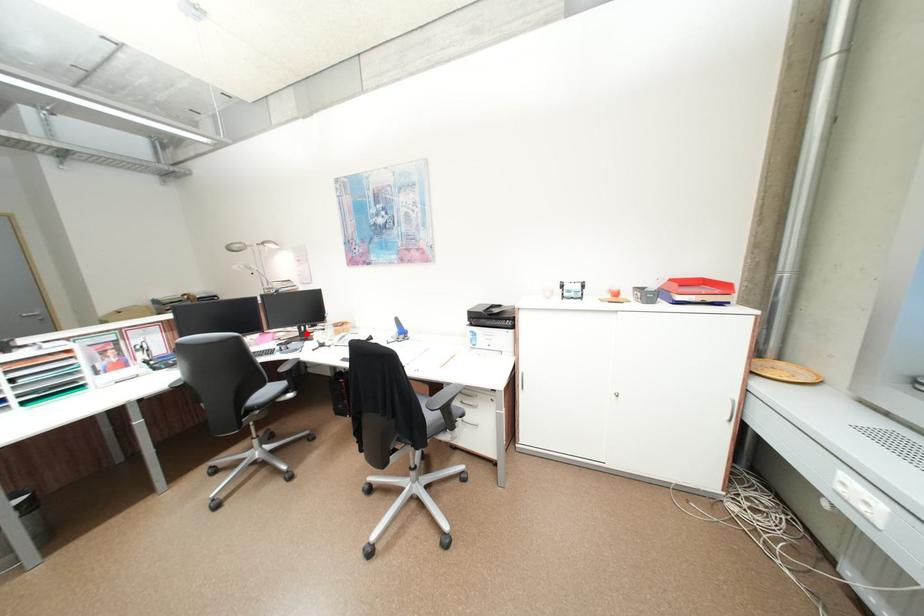
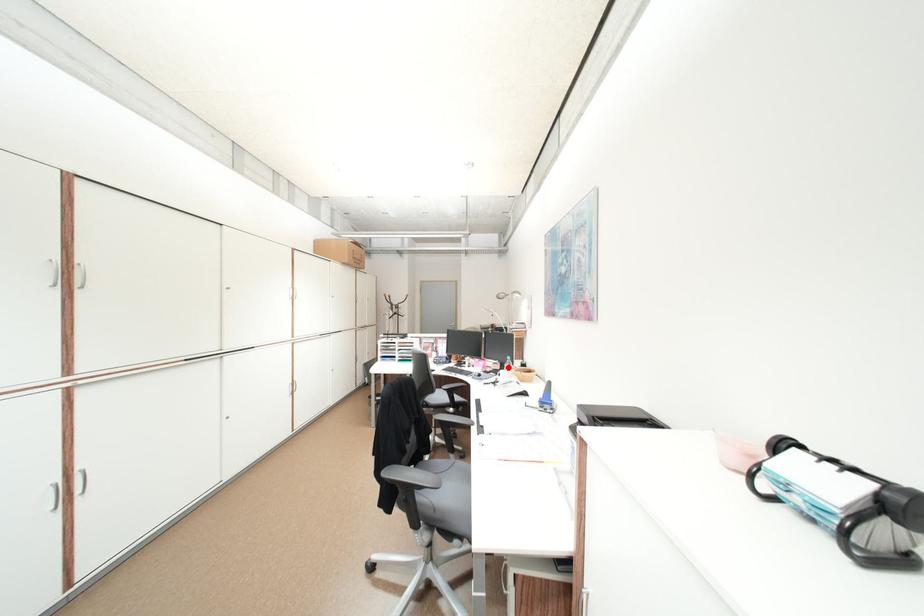
I am providing you with two images of the same scene from different viewpoints. A red point is marked on the first image and another point is marked on the second image. Is the marked point in image1 the same physical position as the marked point in image2?

Yes